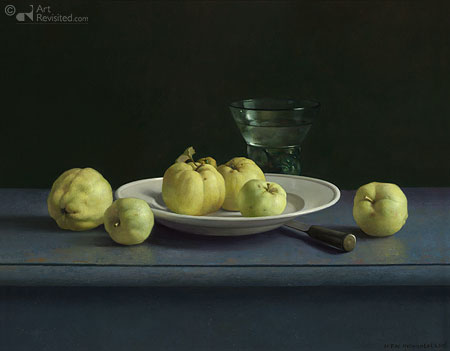
Where is `glass`? The width and height of the screenshot is (450, 351). glass is located at coordinates (268, 137).